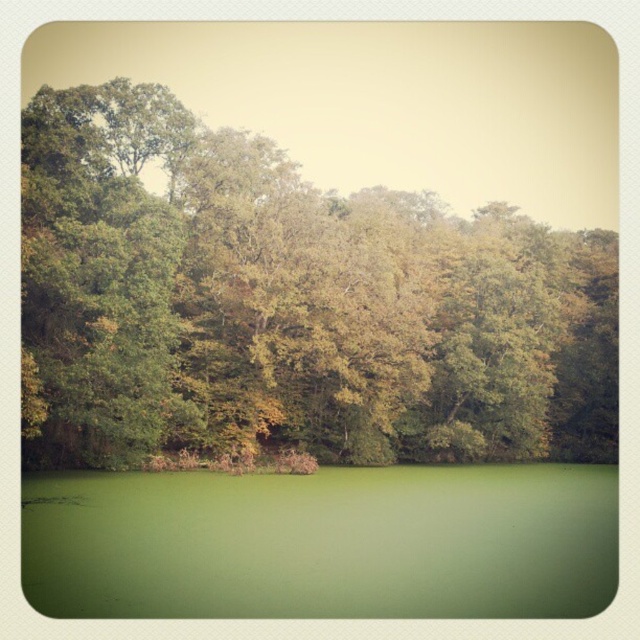
Question: Among these points, which one is farthest from the camera?

Choices:
 (A) (548, 596)
 (B) (554, 353)

Answer: (B)

Question: Does green leafy trees at upper center appear on the left side of green matte water at bottom?

Choices:
 (A) no
 (B) yes

Answer: (B)

Question: Which object appears farthest from the camera in this image?

Choices:
 (A) green leafy trees at upper center
 (B) green matte water at bottom

Answer: (A)

Question: Can you confirm if green leafy trees at upper center is smaller than green matte water at bottom?

Choices:
 (A) no
 (B) yes

Answer: (A)

Question: Is the position of green leafy trees at upper center less distant than that of green matte water at bottom?

Choices:
 (A) yes
 (B) no

Answer: (B)